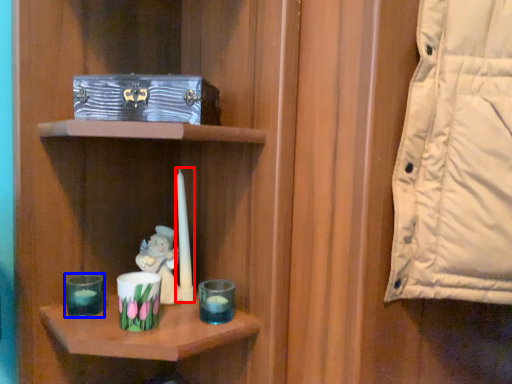
Question: Which point is closer to the camera, birthday candle (highlighted by a red box) or candle holder (highlighted by a blue box)?

Choices:
 (A) birthday candle
 (B) candle holder

Answer: (B)